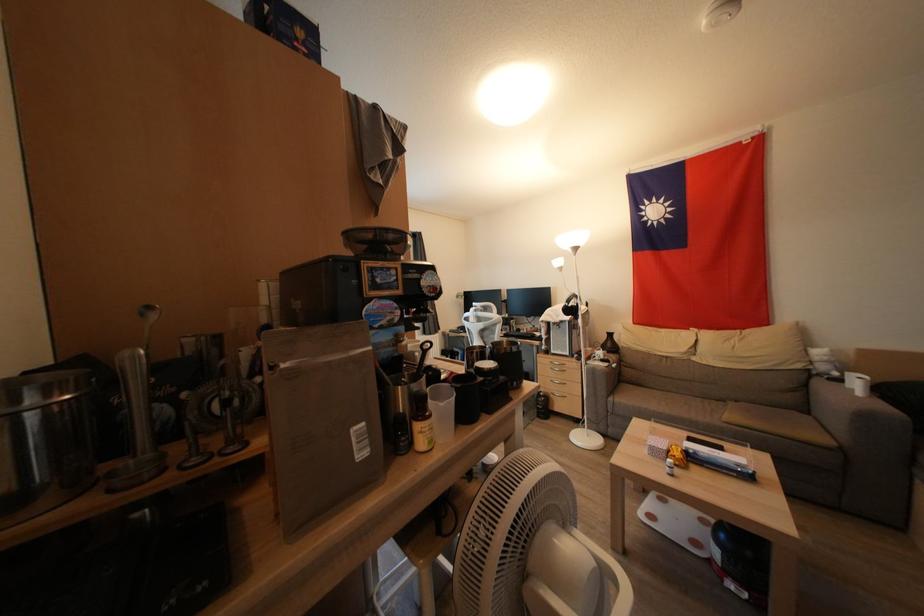
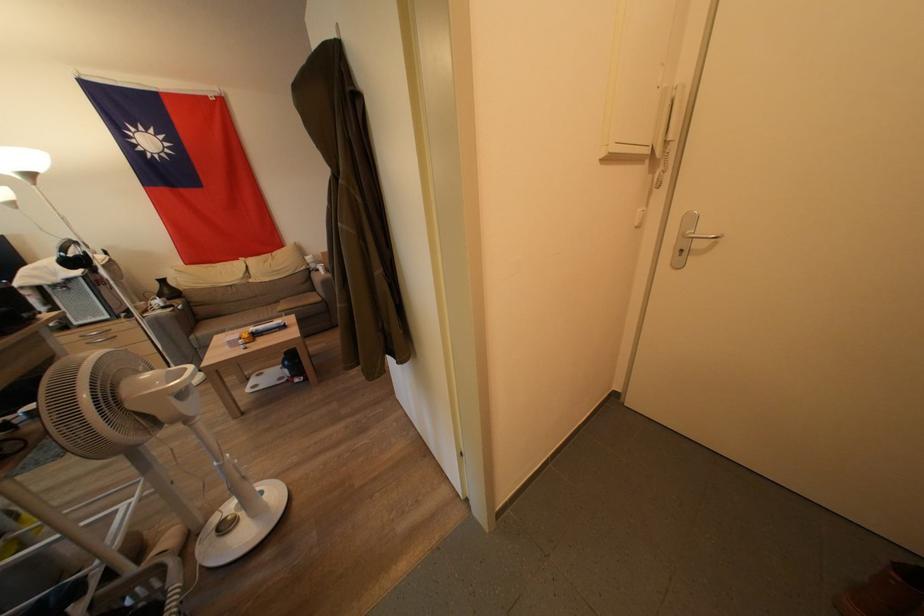
Where in the second image is the point corresponding to pixel 823 387 from the first image?

(319, 278)